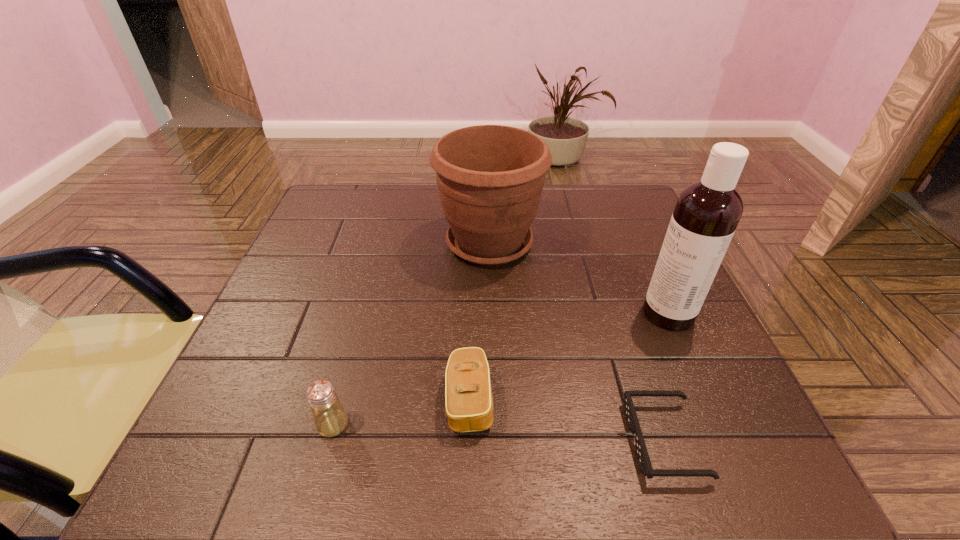
At what (x,y) coordinates should I click in order to perform the action: click on vacant area situated 0.090m on the label side of the dishwasher detergent. Please return your answer as a coordinate pair (x, y). Looking at the image, I should click on (599, 313).

Identify the location of vacant position located on the right of the fourth shortest object. (645, 243).

This screenshot has height=540, width=960. In order to click on blank area located 0.050m on the right of the saltshaker in this screenshot , I will do `click(379, 424)`.

Where is `vacant space located on the zipper side of the fourth tallest object`? vacant space located on the zipper side of the fourth tallest object is located at coordinates (647, 400).

At what (x,y) coordinates should I click in order to perform the action: click on vacant region located on the front-facing side of the sunglasses. Please return your answer as a coordinate pair (x, y). Looking at the image, I should click on (548, 441).

Identify the location of free location located on the front-facing side of the sunglasses. (414, 441).

This screenshot has width=960, height=540. I want to click on free region located 0.170m on the front-facing side of the sunglasses, so click(522, 441).

This screenshot has height=540, width=960. What are the coordinates of `object positioned at the far edge` in the screenshot? It's located at (490, 178).

Identify the location of saltshaker that is at the near edge. The width and height of the screenshot is (960, 540). (330, 418).

This screenshot has width=960, height=540. I want to click on clutch bag located at the near edge, so click(468, 393).